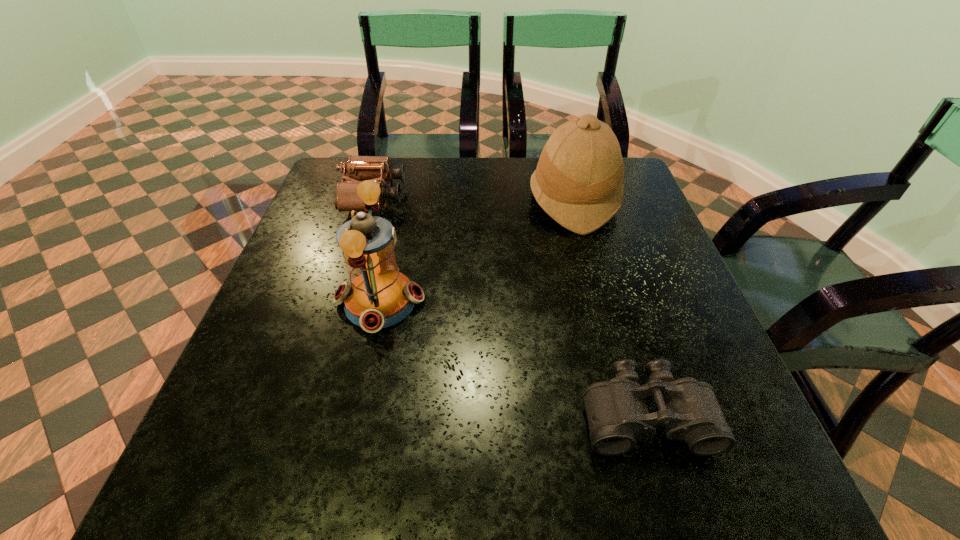
The image size is (960, 540). What are the coordinates of `free space located 0.050m through the eyepieces of the farther binoculars` in the screenshot? It's located at (422, 197).

Locate an element on the screen. The image size is (960, 540). hat that is at the far edge is located at coordinates (578, 182).

Find the location of a particular element. The width and height of the screenshot is (960, 540). binoculars situated at the far edge is located at coordinates 379,169.

The height and width of the screenshot is (540, 960). I want to click on object that is at the near edge, so pyautogui.click(x=617, y=414).

I want to click on lantern at the left edge, so click(x=378, y=295).

You are a GUI agent. You are given a task and a screenshot of the screen. Output one action in this format:
    pyautogui.click(x=<x>, y=<y>)
    Task: Click on the binoculars situated at the left edge
    The width and height of the screenshot is (960, 540).
    Given the screenshot: What is the action you would take?
    pyautogui.click(x=379, y=169)

Find the location of `hat that is at the right edge`. hat that is at the right edge is located at coordinates (578, 182).

The width and height of the screenshot is (960, 540). I want to click on binoculars that is at the right edge, so click(x=617, y=414).

Find the location of a particular element. The image size is (960, 540). object situated at the far left corner is located at coordinates (379, 169).

Locate an element on the screen. The height and width of the screenshot is (540, 960). object positioned at the far right corner is located at coordinates (578, 182).